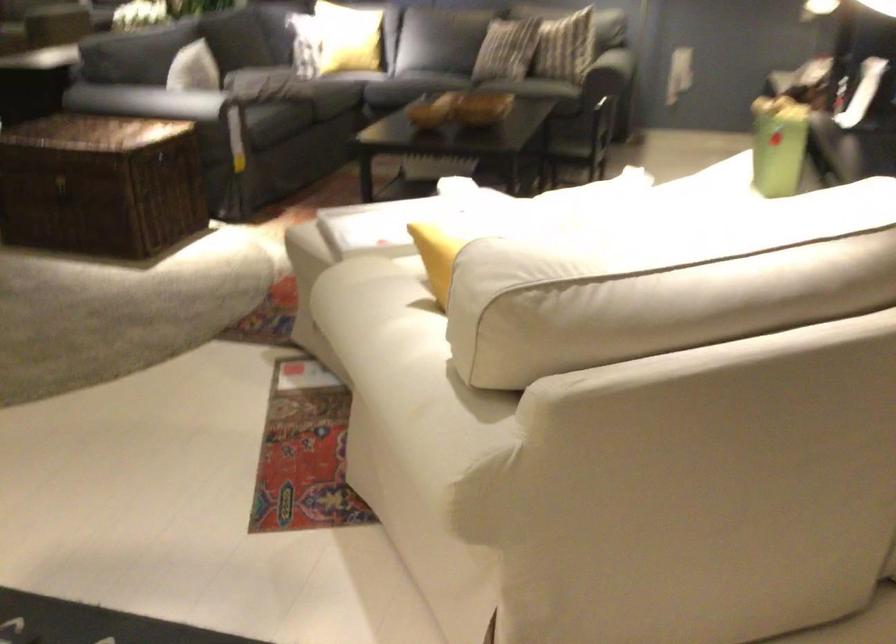
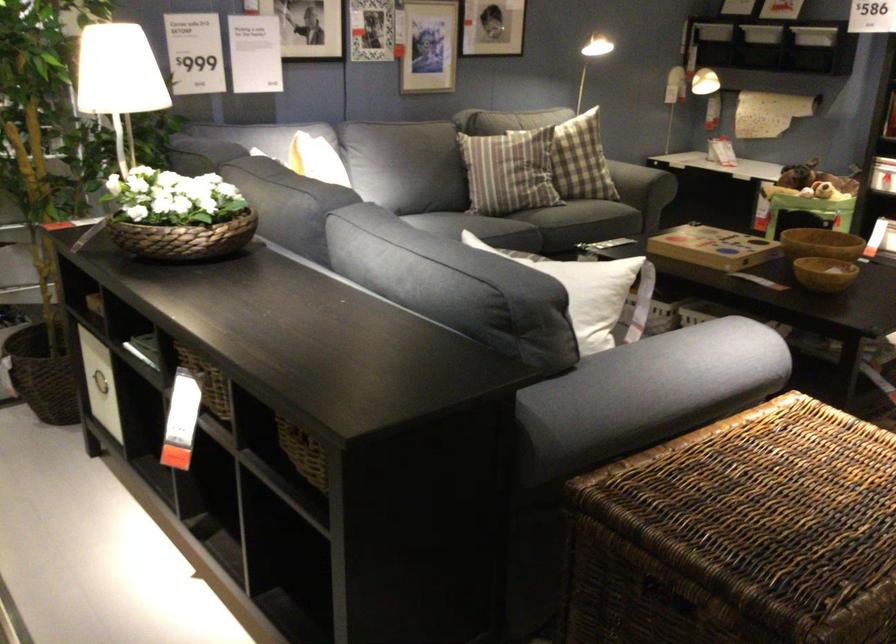
Where in the second image is the point corresponding to [95,146] from the first image?

(776, 509)